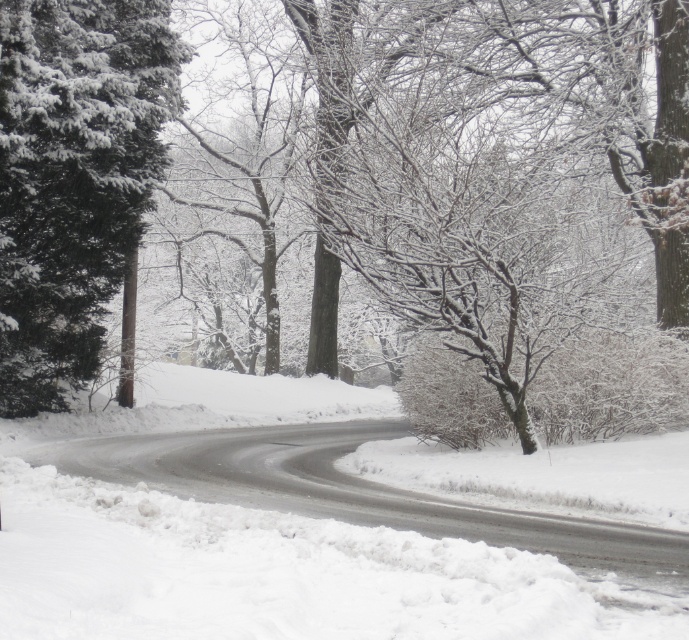
Who is positioned more to the right, white fluffy snow at center or green matte evergreen tree at left?

white fluffy snow at center is more to the right.

Can you confirm if white fluffy snow at center is bigger than green matte evergreen tree at left?

Yes, white fluffy snow at center is bigger than green matte evergreen tree at left.

Find the location of `white fluffy snow at center`. white fluffy snow at center is located at coordinates (265, 545).